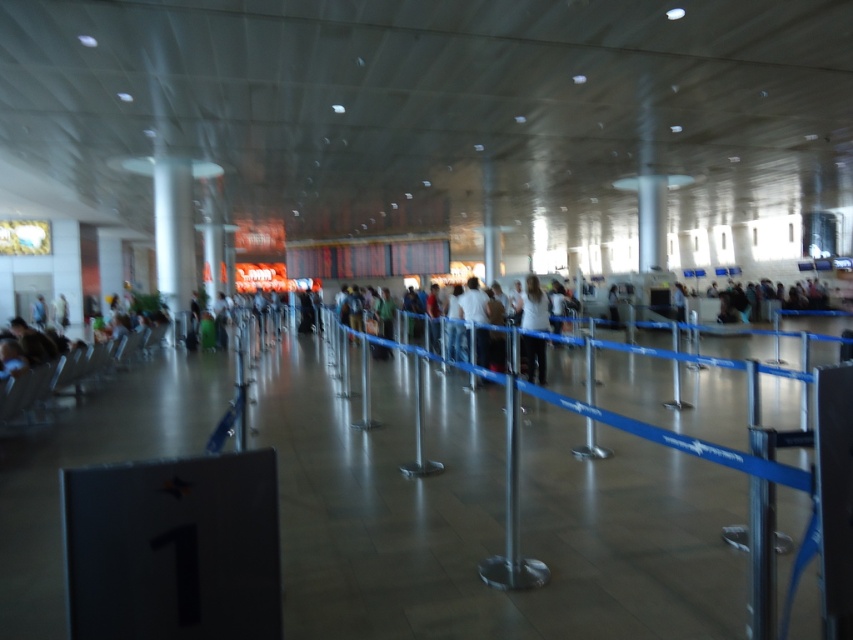
In the scene shown: You are a traveler standing at the entrance of the queue area in the airport terminal. You see the blue rubber barrier at center and the white shirt at center. Which object is narrower?

The blue rubber barrier at center is narrower than the white shirt at center.

You are a passenger in an airport terminal and you see the blue rubber barrier at center and the white shirt at center. Which object is smaller in size?

The blue rubber barrier at center is smaller in size compared to the white shirt at center.